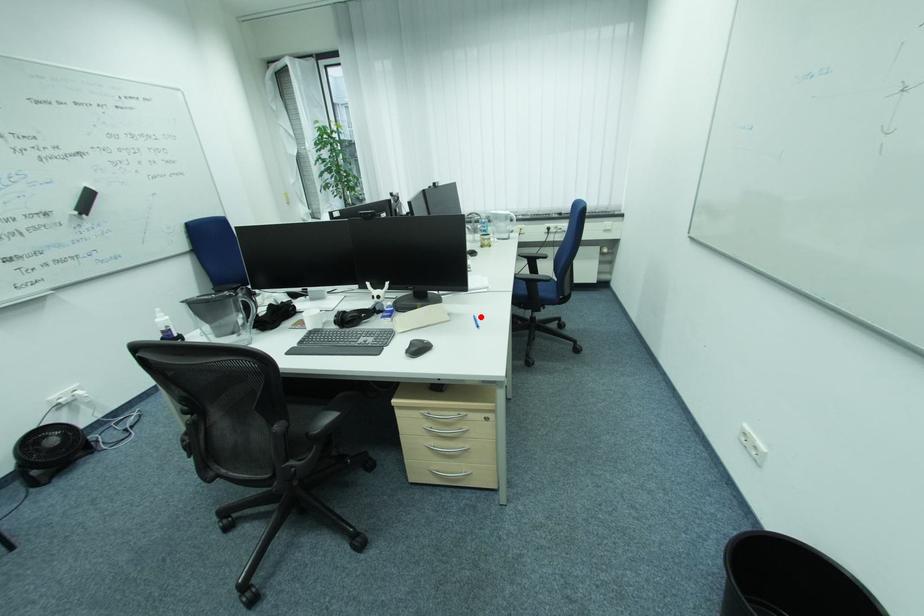
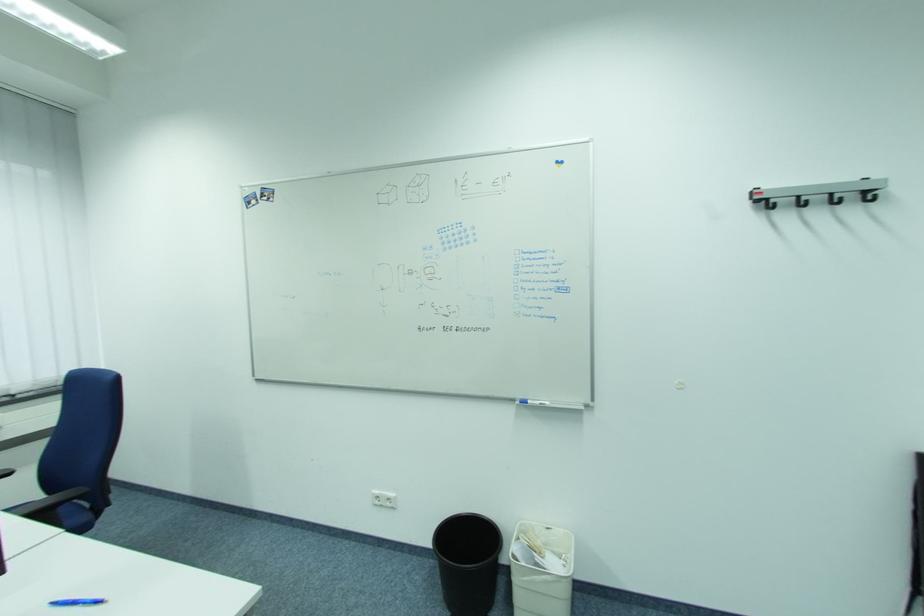
Find the pixel in the second image that matches the highlighted location in the first image.

(57, 605)